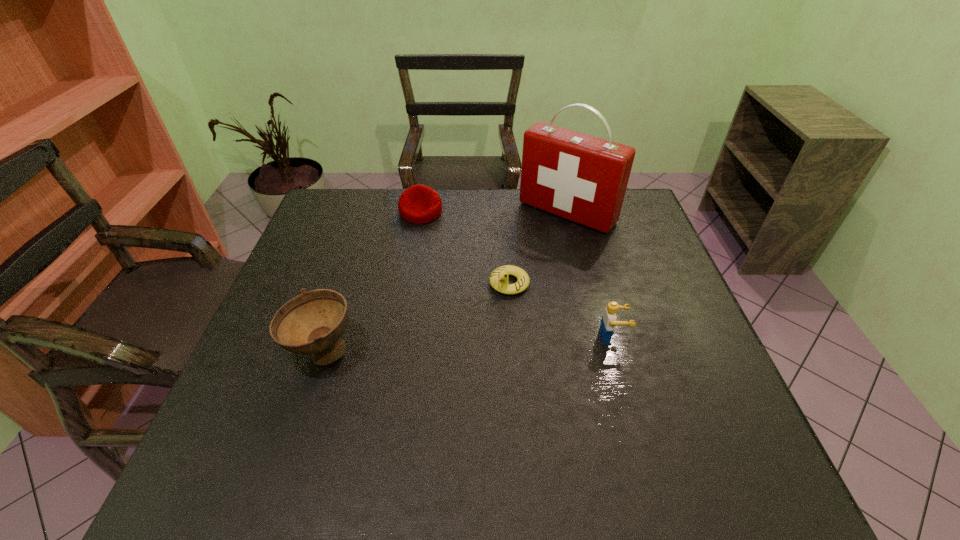
I want to click on free space located 0.320m on the face of the duckling, so click(420, 381).

The width and height of the screenshot is (960, 540). What are the coordinates of `blank space located 0.340m on the front face of the first-aid kit` in the screenshot? It's located at pos(481,297).

At what (x,y) coordinates should I click in order to perform the action: click on vacant space located on the front face of the first-aid kit. Please return your answer as a coordinate pair (x, y). Looking at the image, I should click on (520, 256).

Image resolution: width=960 pixels, height=540 pixels. Find the location of `vacant space located on the front face of the first-aid kit`. vacant space located on the front face of the first-aid kit is located at coordinates (499, 278).

Where is `vacant space located on the seat area of the fourth object from right to left`? vacant space located on the seat area of the fourth object from right to left is located at coordinates (424, 300).

At what (x,y) coordinates should I click in order to perform the action: click on vacant space located on the seat area of the fourth object from right to left. Please return your answer as a coordinate pair (x, y). The image size is (960, 540). Looking at the image, I should click on click(422, 242).

Where is `vacant space located 0.110m on the seat area of the fourth object from right to left`? The width and height of the screenshot is (960, 540). vacant space located 0.110m on the seat area of the fourth object from right to left is located at coordinates (422, 247).

Locate an element on the screen. Image resolution: width=960 pixels, height=540 pixels. the first-aid kit that is at the far edge is located at coordinates (582, 178).

I want to click on beanbag that is at the far edge, so click(x=418, y=204).

Identify the location of object present at the left edge. The width and height of the screenshot is (960, 540). (313, 322).